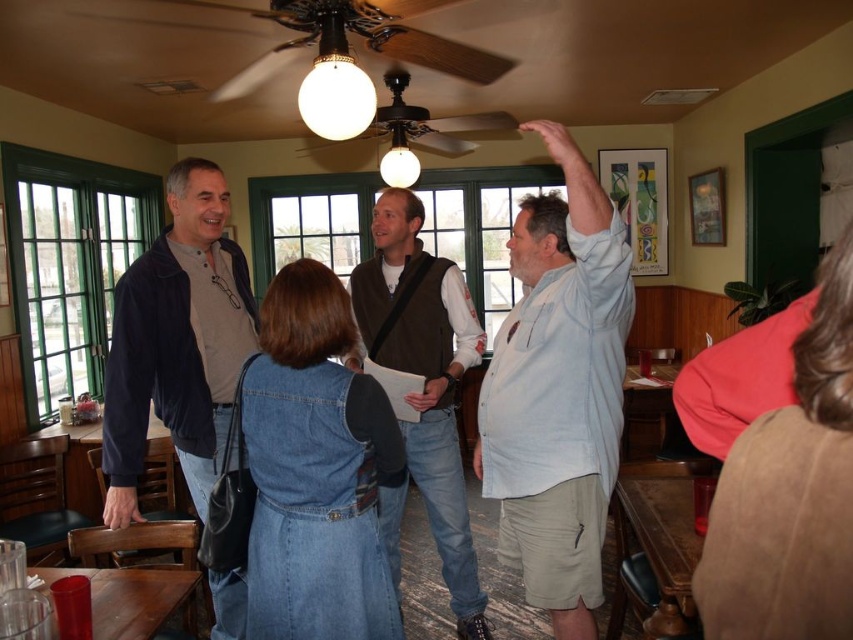
Is denim dress at center closer to camera compared to dark blue velvety jacket at left?

Yes, denim dress at center is in front of dark blue velvety jacket at left.

Can you confirm if denim dress at center is taller than dark blue velvety jacket at left?

Incorrect, denim dress at center's height is not larger of dark blue velvety jacket at left's.

Between point (294, 385) and point (196, 344), which one is positioned in front?

Point (294, 385) is more forward.

Image resolution: width=853 pixels, height=640 pixels. In order to click on denim dress at center in this screenshot , I will do `click(315, 470)`.

This screenshot has height=640, width=853. What do you see at coordinates (558, 388) in the screenshot?
I see `light blue cotton shirt at upper right` at bounding box center [558, 388].

Which is behind, point (526, 353) or point (430, 49)?

Positioned behind is point (430, 49).

Image resolution: width=853 pixels, height=640 pixels. In order to click on light blue cotton shirt at upper right in this screenshot , I will do `click(558, 388)`.

This screenshot has width=853, height=640. Find the location of `light blue cotton shirt at upper right`. light blue cotton shirt at upper right is located at coordinates (558, 388).

Between pink fabric at upper right and brown suede vest at center, which one has less height?

pink fabric at upper right is shorter.

Does pink fabric at upper right appear over brown suede vest at center?

Yes.

Is point (840, 253) positioned behind point (436, 422)?

No, it is in front of (436, 422).

Find the location of a particular element. Image resolution: width=853 pixels, height=640 pixels. pink fabric at upper right is located at coordinates (790, 493).